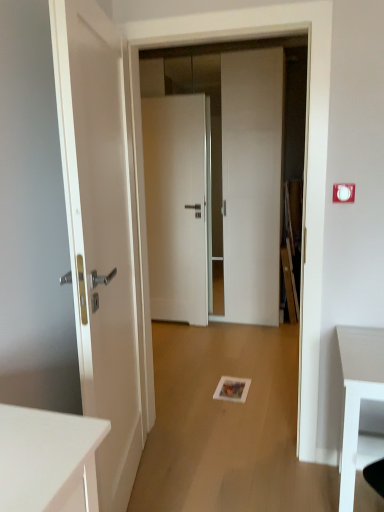
You are a GUI agent. You are given a task and a screenshot of the screen. Output one action in this format:
    pyautogui.click(x=<x>, y=<y>)
    Task: Click on the free space in front of white matte door at center, acting as the third door starting from the front
    The height and width of the screenshot is (512, 384).
    Given the screenshot: What is the action you would take?
    pyautogui.click(x=181, y=336)